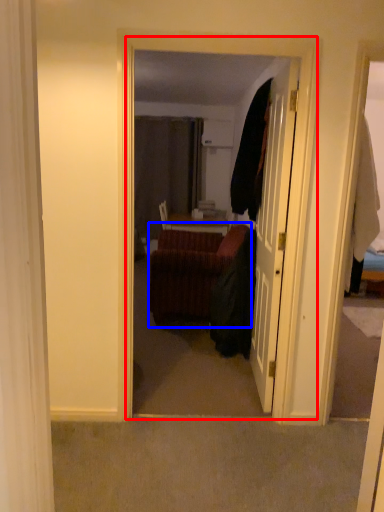
Question: Which point is closer to the camera, corridor (highlighted by a red box) or studio couch (highlighted by a blue box)?

Choices:
 (A) corridor
 (B) studio couch

Answer: (A)